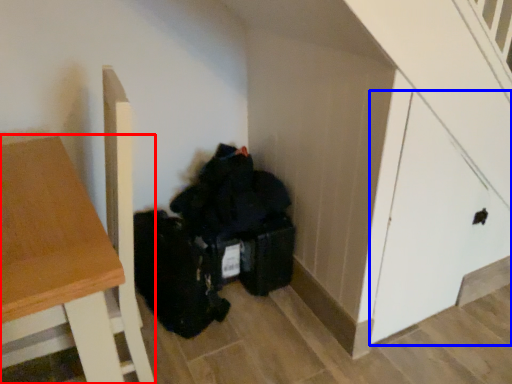
Question: Among these objects, which one is farthest to the camera, table (highlighted by a red box) or door (highlighted by a blue box)?

Choices:
 (A) table
 (B) door

Answer: (B)